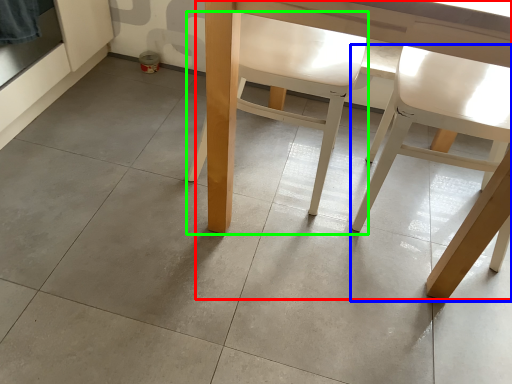
Question: Considering the real-world distances, which object is farthest from table (highlighted by a red box)? chair (highlighted by a blue box) or chair (highlighted by a green box)?

Choices:
 (A) chair
 (B) chair

Answer: (A)